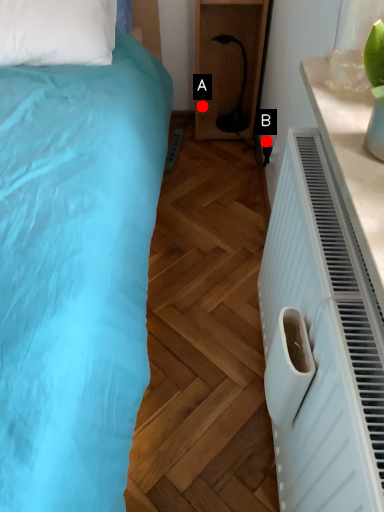
Question: Two points are circled on the image, labeled by A and B beside each circle. Among these points, which one is farthest from the camera?

Choices:
 (A) A is further
 (B) B is further

Answer: (A)